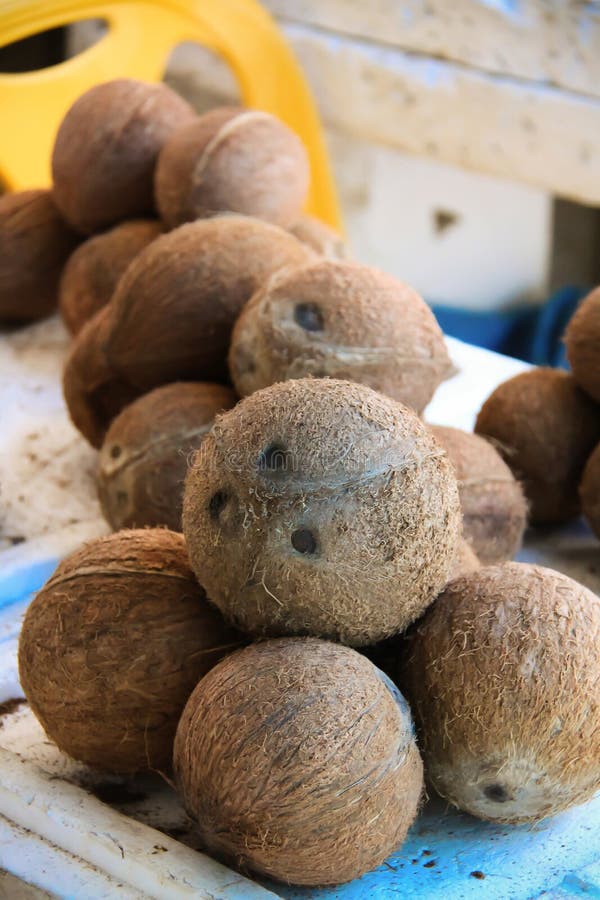
Image resolution: width=600 pixels, height=900 pixels. Identify the location of blue fabric. (507, 336).